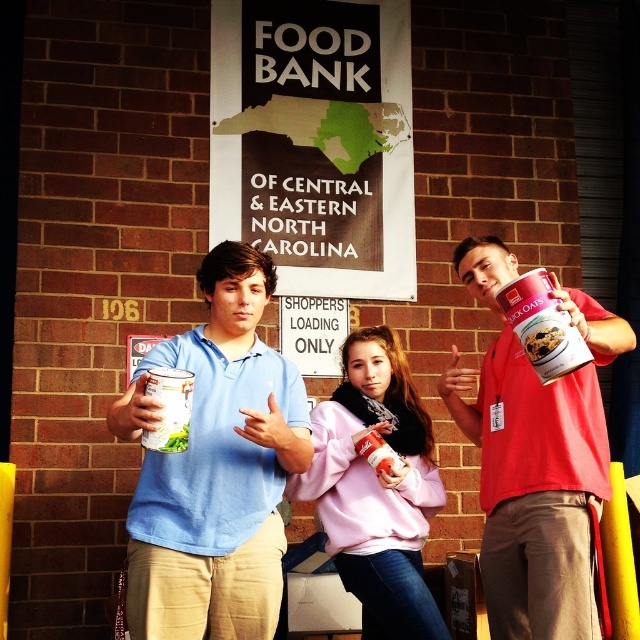
Question: Among these objects, which one is nearest to the camera?

Choices:
 (A) matte blue shirt at center
 (B) matte plastic can at right

Answer: (B)

Question: Can you confirm if matte blue shirt at center is positioned to the right of pink fleece sweater at center?

Choices:
 (A) no
 (B) yes

Answer: (A)

Question: Which of the following is the farthest from the observer?

Choices:
 (A) pink fleece sweater at center
 (B) matte blue shirt at center

Answer: (A)

Question: Among these objects, which one is nearest to the camera?

Choices:
 (A) matte blue shirt at center
 (B) matte black sign at center
 (C) matte red can at center
 (D) matte plastic can at right

Answer: (C)

Question: Does matte blue shirt at center appear on the left side of matte plastic can at right?

Choices:
 (A) no
 (B) yes

Answer: (B)

Question: Does matte plastic can at right appear under matte plastic cup at center?

Choices:
 (A) yes
 (B) no

Answer: (B)